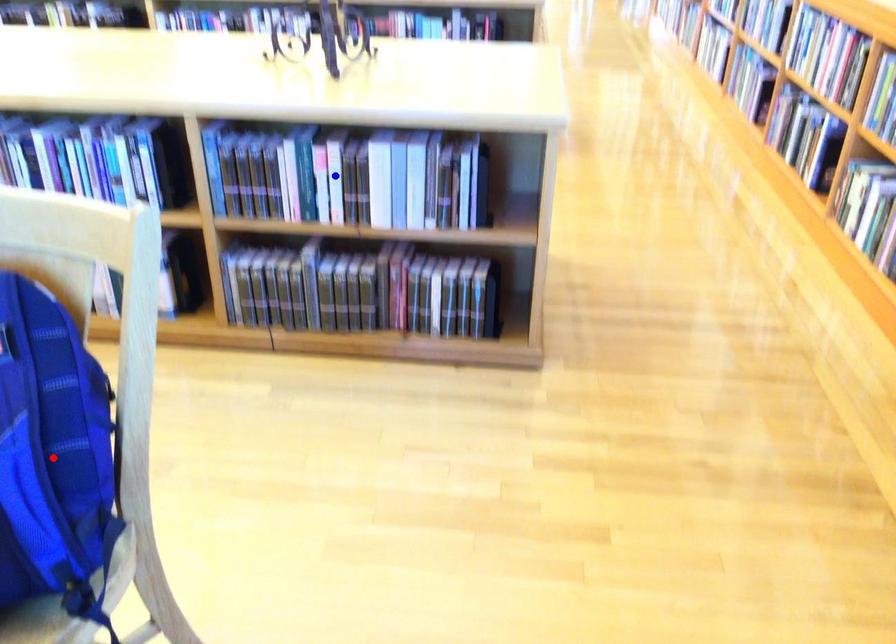
Question: Two points are marked on the image. Which point is closer to the camera?

Choices:
 (A) Blue point is closer.
 (B) Red point is closer.

Answer: (B)